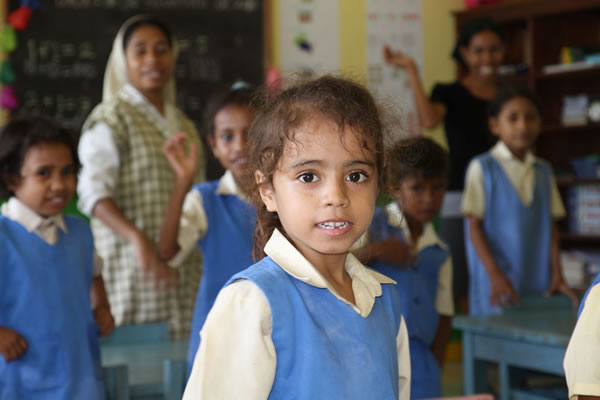
The height and width of the screenshot is (400, 600). In order to click on pale yellow painted wall in this screenshot , I will do `click(347, 40)`.